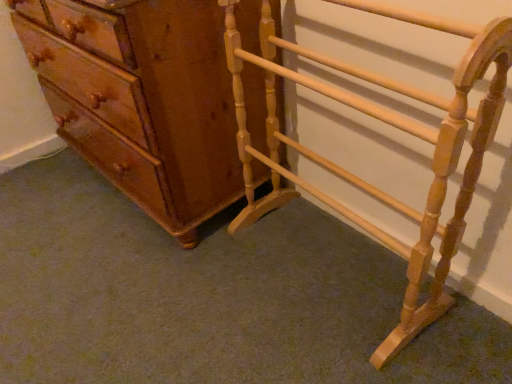
This screenshot has width=512, height=384. What do you see at coordinates (390, 125) in the screenshot?
I see `light wood towel rack at right` at bounding box center [390, 125].

Where is `light wood towel rack at right`? The height and width of the screenshot is (384, 512). light wood towel rack at right is located at coordinates (390, 125).

Identify the location of matte brown chest of drawers at left. (142, 99).

What do you see at coordinates (142, 99) in the screenshot?
I see `matte brown chest of drawers at left` at bounding box center [142, 99].

Locate an element on the screen. The image size is (512, 384). light wood towel rack at right is located at coordinates (390, 125).

Which object is positioned more to the left, matte brown chest of drawers at left or light wood towel rack at right?

matte brown chest of drawers at left.

Is matte brown chest of drawers at left closer to the viewer compared to light wood towel rack at right?

No, matte brown chest of drawers at left is further to the viewer.

Which is farther, (65, 123) or (421, 283)?

Positioned behind is point (65, 123).

From the image's perspective, is matte brown chest of drawers at left over light wood towel rack at right?

Correct, matte brown chest of drawers at left appears higher than light wood towel rack at right in the image.

From the picture: From a real-world perspective, does matte brown chest of drawers at left stand above light wood towel rack at right?

Indeed, from a real-world perspective, matte brown chest of drawers at left stands above light wood towel rack at right.

Can you confirm if matte brown chest of drawers at left is thinner than light wood towel rack at right?

No, matte brown chest of drawers at left is not thinner than light wood towel rack at right.

Considering the sizes of matte brown chest of drawers at left and light wood towel rack at right in the image, is matte brown chest of drawers at left taller or shorter than light wood towel rack at right?

In the image, matte brown chest of drawers at left appears to be shorter than light wood towel rack at right.

In terms of size, does matte brown chest of drawers at left appear bigger or smaller than light wood towel rack at right?

matte brown chest of drawers at left is bigger than light wood towel rack at right.

Is matte brown chest of drawers at left outside of light wood towel rack at right?

matte brown chest of drawers at left lies outside light wood towel rack at right's area.

Would you consider matte brown chest of drawers at left to be distant from light wood towel rack at right?

No, matte brown chest of drawers at left is not far away from light wood towel rack at right.

Is matte brown chest of drawers at left oriented towards light wood towel rack at right?

No, matte brown chest of drawers at left is not facing towards light wood towel rack at right.

How many degrees apart are the facing directions of matte brown chest of drawers at left and light wood towel rack at right?

They differ by 5.45 degrees in their facing directions.

Locate an element on the screen. The image size is (512, 384). the chest of drawers that is behind the light wood towel rack at right is located at coordinates (142, 99).

Is light wood towel rack at right to the left of matte brown chest of drawers at left from the viewer's perspective?

No, light wood towel rack at right is not to the left of matte brown chest of drawers at left.

Which object is closer to the camera taking this photo, light wood towel rack at right or matte brown chest of drawers at left?

light wood towel rack at right.

Considering the positions of points (441, 163) and (178, 194), is point (441, 163) closer to camera compared to point (178, 194)?

Yes, point (441, 163) is in front of point (178, 194).

From the image's perspective, between light wood towel rack at right and matte brown chest of drawers at left, who is located below?

From the image's view, light wood towel rack at right is below.

From a real-world perspective, between light wood towel rack at right and matte brown chest of drawers at left, who is vertically lower?

light wood towel rack at right.

Considering the sizes of objects light wood towel rack at right and matte brown chest of drawers at left in the image provided, who is thinner, light wood towel rack at right or matte brown chest of drawers at left?

With smaller width is light wood towel rack at right.

In terms of height, does light wood towel rack at right look taller or shorter compared to matte brown chest of drawers at left?

Considering their sizes, light wood towel rack at right has more height than matte brown chest of drawers at left.

Who is bigger, light wood towel rack at right or matte brown chest of drawers at left?

Bigger between the two is matte brown chest of drawers at left.

Is light wood towel rack at right located outside matte brown chest of drawers at left?

Yes, light wood towel rack at right is located beyond the bounds of matte brown chest of drawers at left.

Are light wood towel rack at right and matte brown chest of drawers at left located far from each other?

They are positioned close to each other.

Is light wood towel rack at right facing away from matte brown chest of drawers at left?

No, light wood towel rack at right's orientation is not away from matte brown chest of drawers at left.

Can you tell me how much light wood towel rack at right and matte brown chest of drawers at left differ in facing direction?

5.45 degrees.

Measure the distance between light wood towel rack at right and matte brown chest of drawers at left.

light wood towel rack at right is 13.04 inches away from matte brown chest of drawers at left.

The height and width of the screenshot is (384, 512). I want to click on the chest of drawers lying above the light wood towel rack at right (from the image's perspective), so click(142, 99).

This screenshot has height=384, width=512. What are the coordinates of `chest of drawers behind the light wood towel rack at right` in the screenshot? It's located at (142, 99).

Find the location of a particular element. The width and height of the screenshot is (512, 384). chest of drawers on the left of light wood towel rack at right is located at coordinates (x=142, y=99).